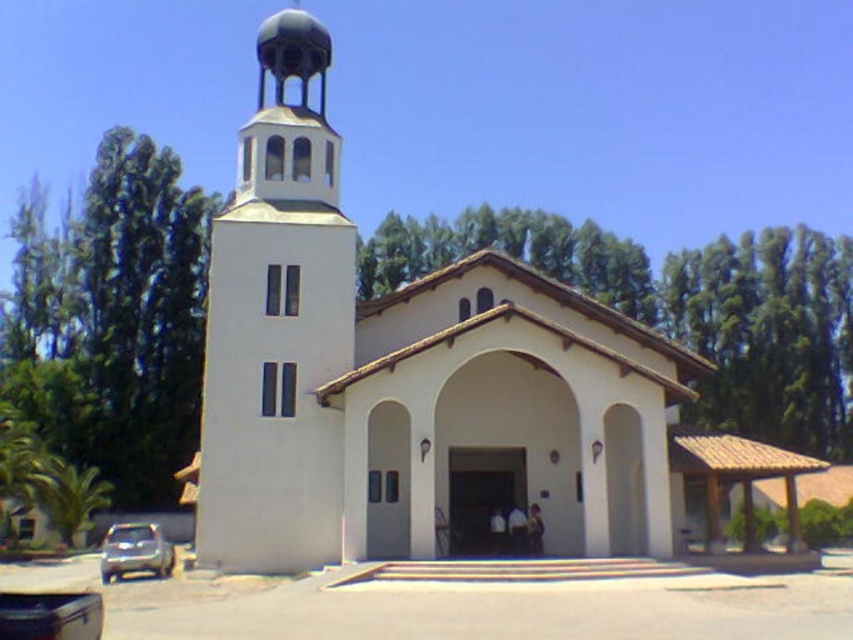
From the picture: You are a photographer planning to capture the white smooth church at center and the satin silver suv at lower left in a single frame. Given that the church is larger, which object should you position closer to the camera to maintain their relative sizes in the photo?

To maintain their relative sizes, you should position the satin silver suv at lower left closer to the camera since the white smooth church at center is naturally larger in size.

You are driving a car and see the white smooth bell tower at center and the satin silver suv at lower left in your rearview mirror. Which object is located to the right of the other?

The white smooth bell tower at center is positioned on the right side of the satin silver suv at lower left.